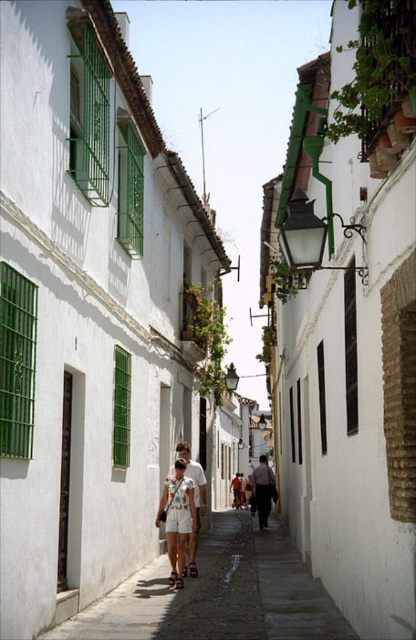
In the scene shown: You are a tourist standing on the cobblestone street in front of the white buildings. You notice the green metal bars at left and the pink fabric shirt at center. Which object appears taller in the scene?

The pink fabric shirt at center is taller than the green metal bars at left.

You are standing on the cobblestone street in the Mediterranean town scene. You notice two points marked on the ground. One is at coordinate point(123, 444) and the other at point(264, 504). Which of these two points is closer to you?

Point(123, 444) is closer to the viewer than point(264, 504).